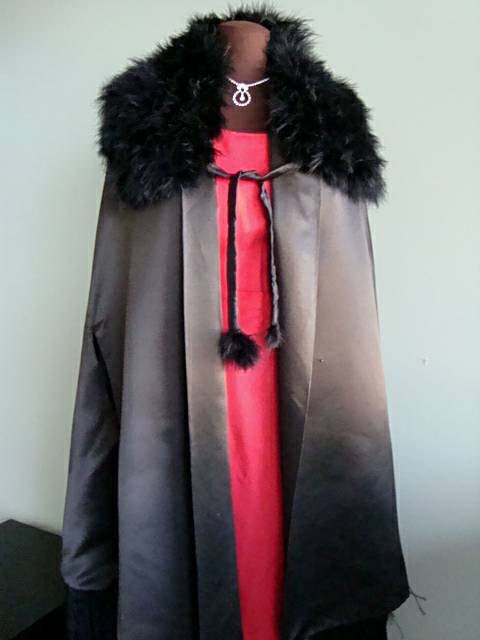
You are a GUI agent. You are given a task and a screenshot of the screen. Output one action in this format:
    pyautogui.click(x=<x>, y=<y>)
    Task: Click on the mannequin
    Image resolution: width=480 pixels, height=640 pixels.
    Given the screenshot: What is the action you would take?
    pyautogui.click(x=252, y=546)